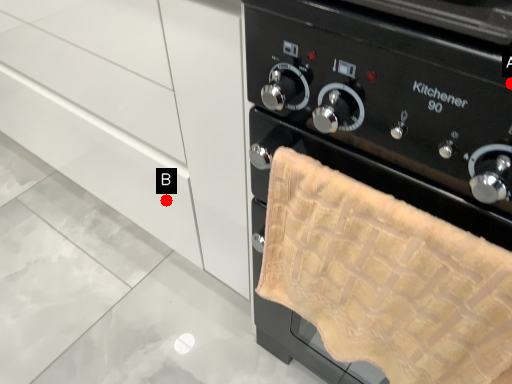
Question: Two points are circled on the image, labeled by A and B beside each circle. Which point is farther to the camera?

Choices:
 (A) A is further
 (B) B is further

Answer: (B)